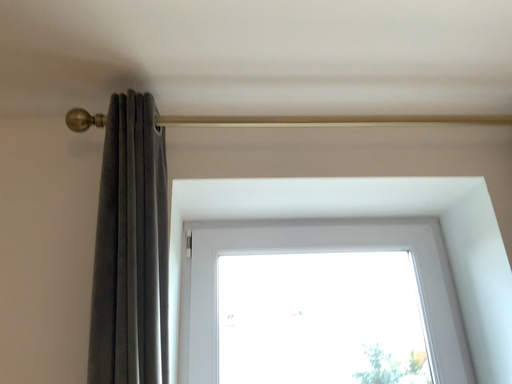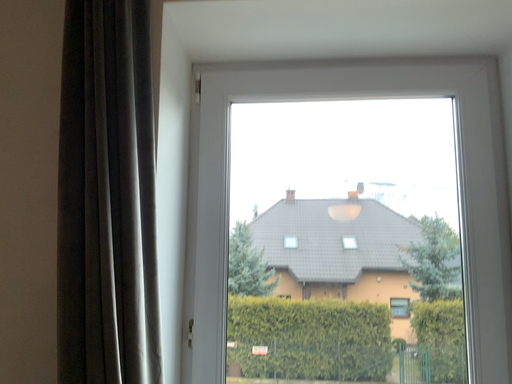
Question: How did the camera likely rotate when shooting the video?

Choices:
 (A) rotated right
 (B) rotated left

Answer: (B)